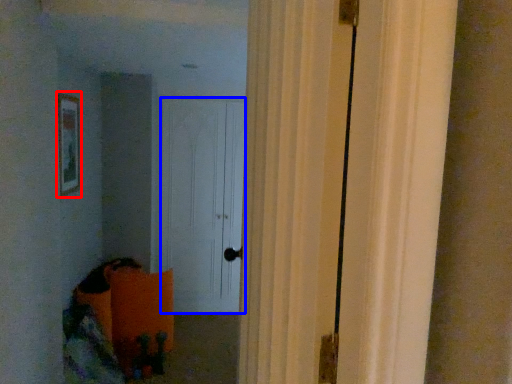
Question: Among these objects, which one is nearest to the camera, picture frame (highlighted by a red box) or door (highlighted by a blue box)?

Choices:
 (A) picture frame
 (B) door

Answer: (A)